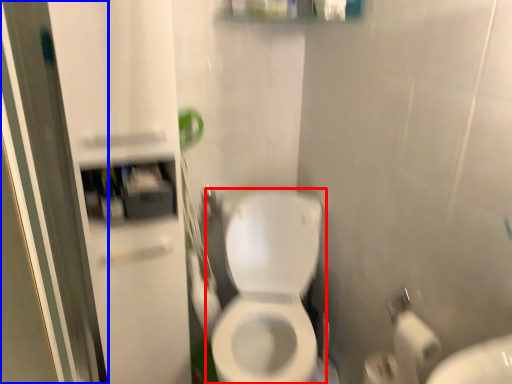
Question: Which object is closer to the camera taking this photo, toilet (highlighted by a red box) or screen door (highlighted by a blue box)?

Choices:
 (A) toilet
 (B) screen door

Answer: (B)